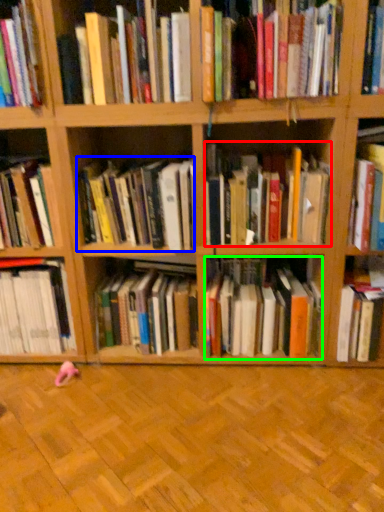
Question: Based on their relative distances, which object is nearer to book (highlighted by a red box)? Choose from book (highlighted by a blue box) and book (highlighted by a green box).

Choices:
 (A) book
 (B) book

Answer: (A)